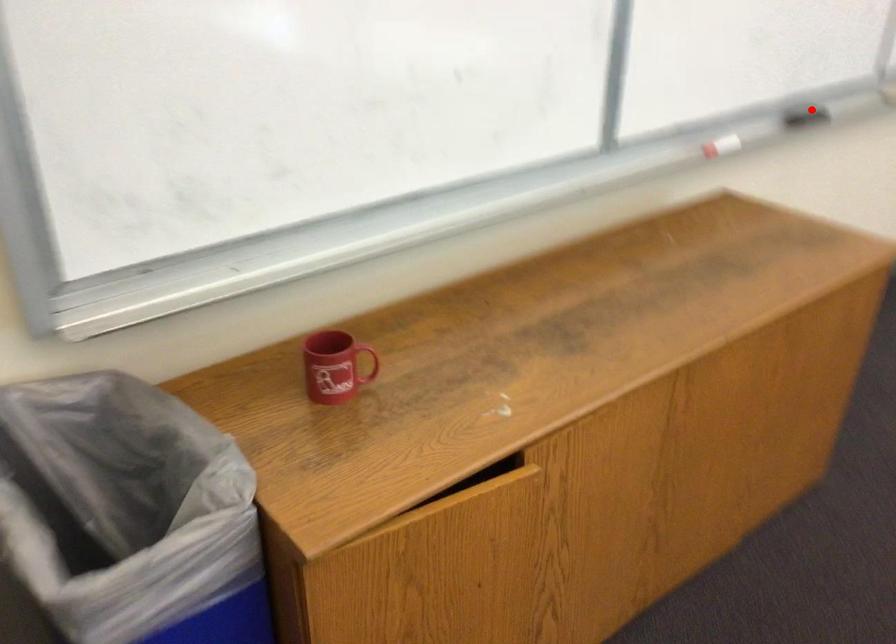
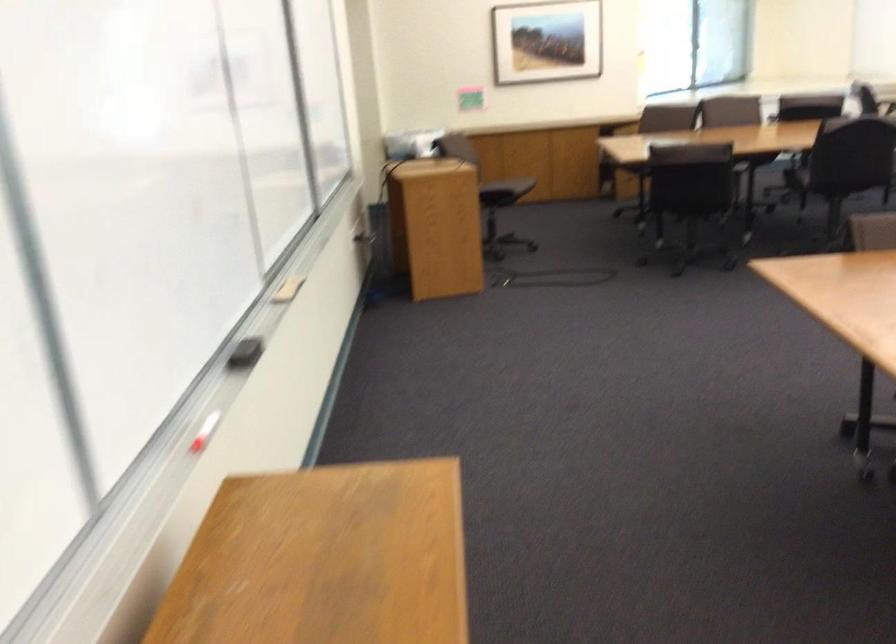
In the second image, find the point that corresponds to the highlighted location in the first image.

(246, 353)